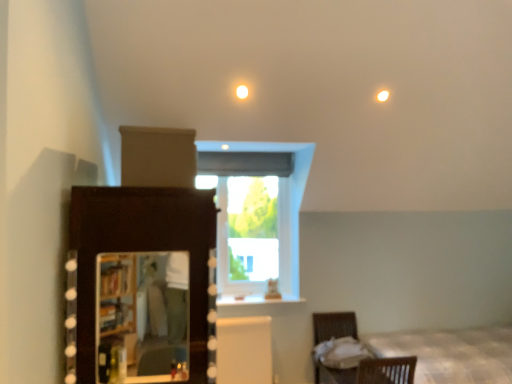
Question: Should I look upward or downward to see white fabric bed at lower right?

Choices:
 (A) up
 (B) down

Answer: (B)

Question: Does brown wicker basket at lower right turn towards white fabric at lower right?

Choices:
 (A) yes
 (B) no

Answer: (A)

Question: Would you consider brown wicker basket at lower right to be distant from white fabric at lower right?

Choices:
 (A) yes
 (B) no

Answer: (B)

Question: Does brown wicker basket at lower right lie behind white fabric at lower right?

Choices:
 (A) no
 (B) yes

Answer: (A)

Question: From a real-world perspective, is brown wicker basket at lower right positioned under white fabric at lower right based on gravity?

Choices:
 (A) no
 (B) yes

Answer: (B)

Question: From the image's perspective, is brown wicker basket at lower right below white fabric at lower right?

Choices:
 (A) no
 (B) yes

Answer: (B)

Question: Considering the relative sizes of brown wicker basket at lower right and white fabric at lower right in the image provided, is brown wicker basket at lower right bigger than white fabric at lower right?

Choices:
 (A) no
 (B) yes

Answer: (B)

Question: Is dark wood dresser at left smaller than transparent glass window at center?

Choices:
 (A) yes
 (B) no

Answer: (B)

Question: Is dark wood dresser at left shorter than transparent glass window at center?

Choices:
 (A) no
 (B) yes

Answer: (A)

Question: Is transparent glass window at center at the back of dark wood dresser at left?

Choices:
 (A) yes
 (B) no

Answer: (B)

Question: Does dark wood dresser at left lie in front of transparent glass window at center?

Choices:
 (A) yes
 (B) no

Answer: (A)

Question: From a real-world perspective, is dark wood dresser at left on top of transparent glass window at center?

Choices:
 (A) yes
 (B) no

Answer: (B)

Question: Is dark wood dresser at left to the left of transparent glass window at center from the viewer's perspective?

Choices:
 (A) no
 (B) yes

Answer: (B)

Question: From a real-world perspective, is transparent glass window at center positioned under matte wooden mirror at lower left based on gravity?

Choices:
 (A) yes
 (B) no

Answer: (B)